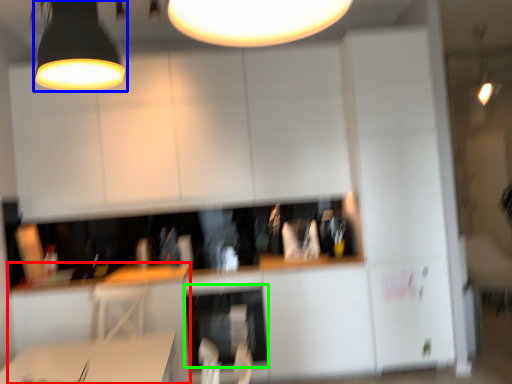
Question: Which object is positioned farthest from computer desk (highlighted by a red box)? Select from lamp (highlighted by a blue box) and dish washer (highlighted by a green box).

Choices:
 (A) lamp
 (B) dish washer

Answer: (A)